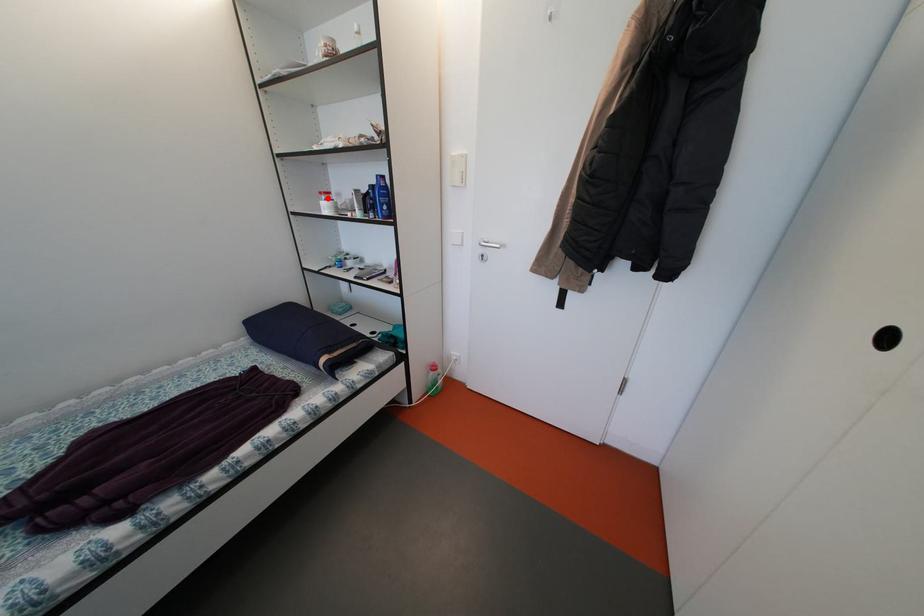
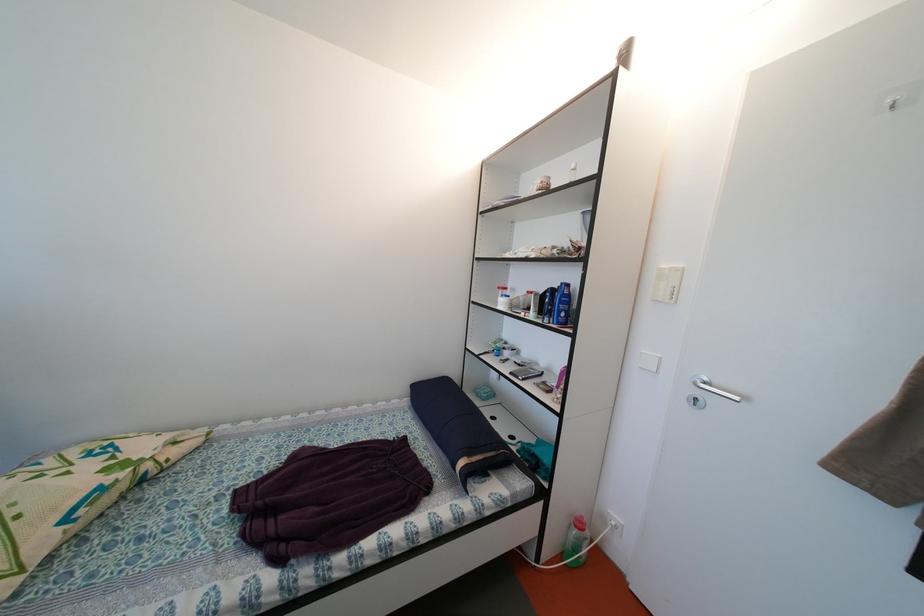
Locate, in the second image, the point that corresponds to the highlighted location in the first image.

(505, 293)